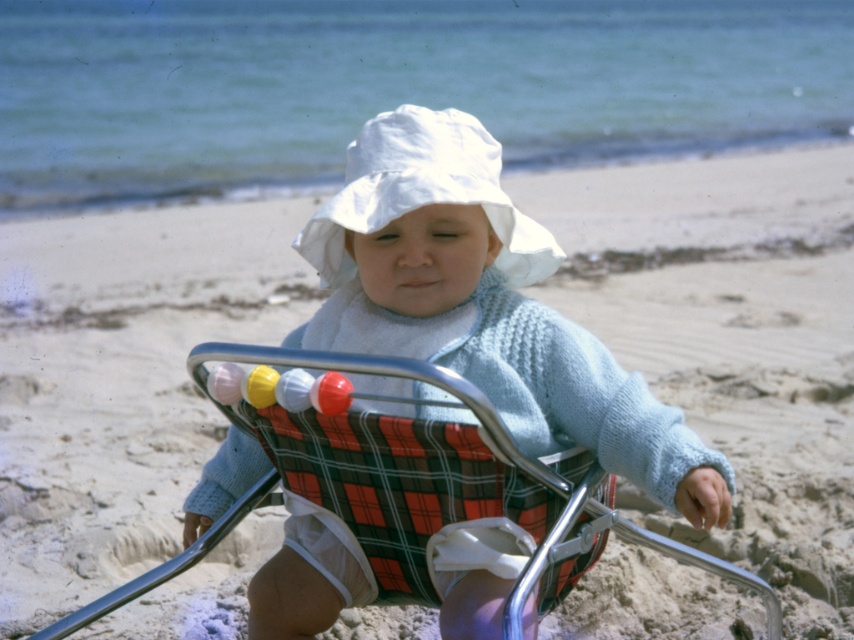
Is point (528, 364) less distant than point (518, 451)?

No.

Who is more forward, (522, 344) or (88, 609)?

Point (522, 344) is more forward.

Find the location of a particular element. white knitted sweater at center is located at coordinates (484, 305).